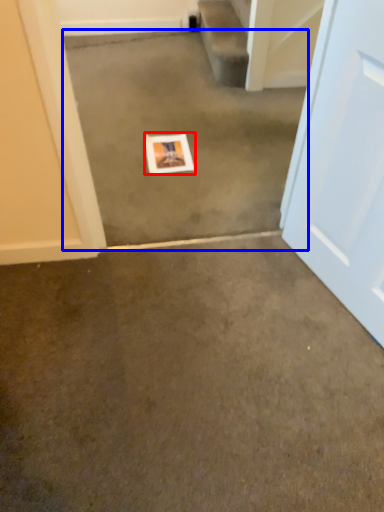
Question: Which point is closer to the camera, picture frame (highlighted by a red box) or concrete (highlighted by a blue box)?

Choices:
 (A) picture frame
 (B) concrete

Answer: (B)